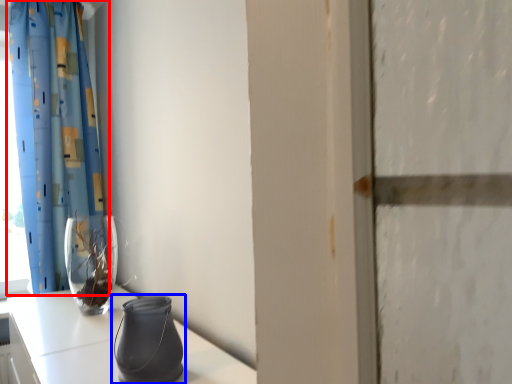
Question: Which object appears closest to the camera in this image, curtain (highlighted by a red box) or vase (highlighted by a blue box)?

Choices:
 (A) curtain
 (B) vase

Answer: (B)